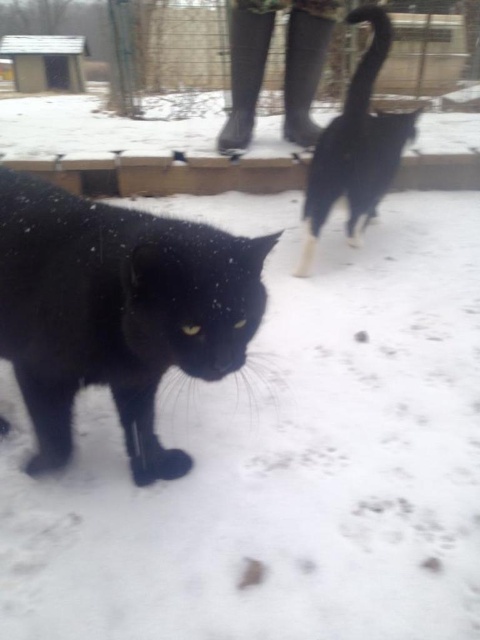
You are a photographer trying to capture both cats in a single shot. Given that the black matte fur cat at center is closer to you, will the black fur cat at upper right appear smaller or larger in the photo?

The black fur cat at upper right will appear smaller in the photo because it is farther away from the photographer compared to the black matte fur cat at center, which is closer. Objects farther away appear smaller in photographs.

You are a photographer trying to capture the black matte fur cat at center. You have a camera with a zoom lens that can focus on objects within a 0.2 radius from the center of the frame. Is the point at coordinates (117, 310) within your camera focus range?

The point at coordinates (117, 310) corresponds to the black matte fur cat at center, which is within the camera focus range of 0.2 radius from the center of the frame. Therefore, the camera can focus on the black matte fur cat at center.

You are a photographer trying to capture both cats in a single frame. Given that your camera can only focus on objects within a 1.5 meter width, can you fit both the black matte fur cat at center and the black fur cat at upper right into the frame without moving the camera?

The black matte fur cat at center might be wider than black fur cat at upper right, but since the camera can focus on objects within a 1.5 meter width, it depends on their actual widths. However, the description only mentions the potential width difference, not exact measurements. Therefore, it is uncertain if both can fit without knowing their exact widths.